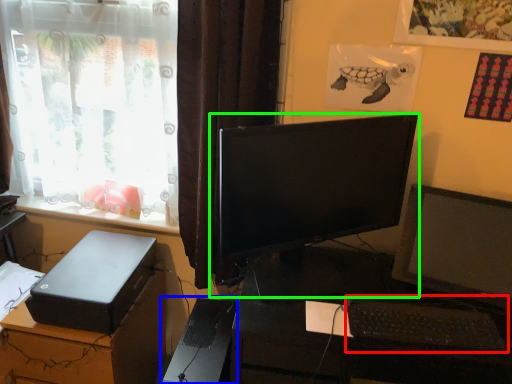
Question: Based on their relative distances, which object is nearer to computer keyboard (highlighted by a red box)? Choose from computer tower (highlighted by a blue box) and computer monitor (highlighted by a green box).

Choices:
 (A) computer tower
 (B) computer monitor

Answer: (B)